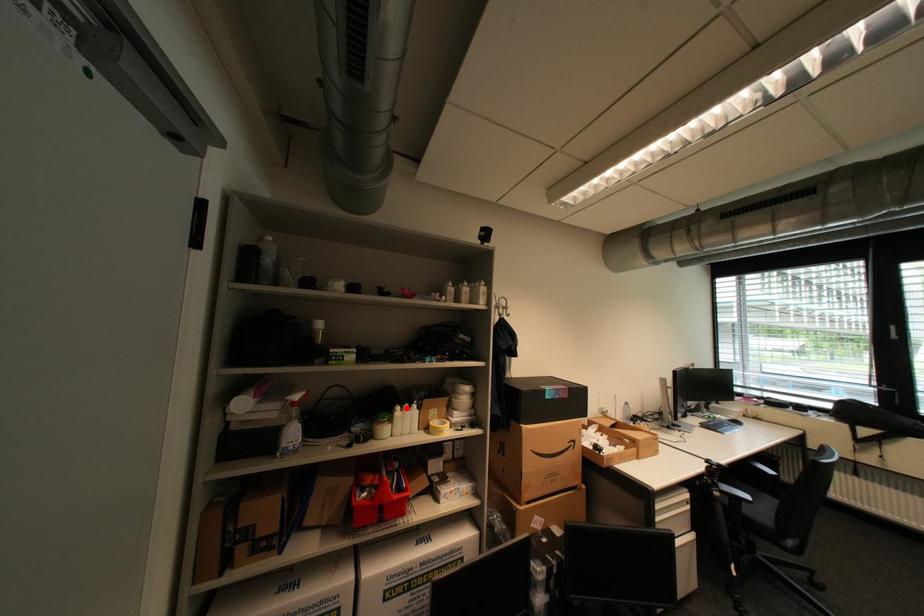
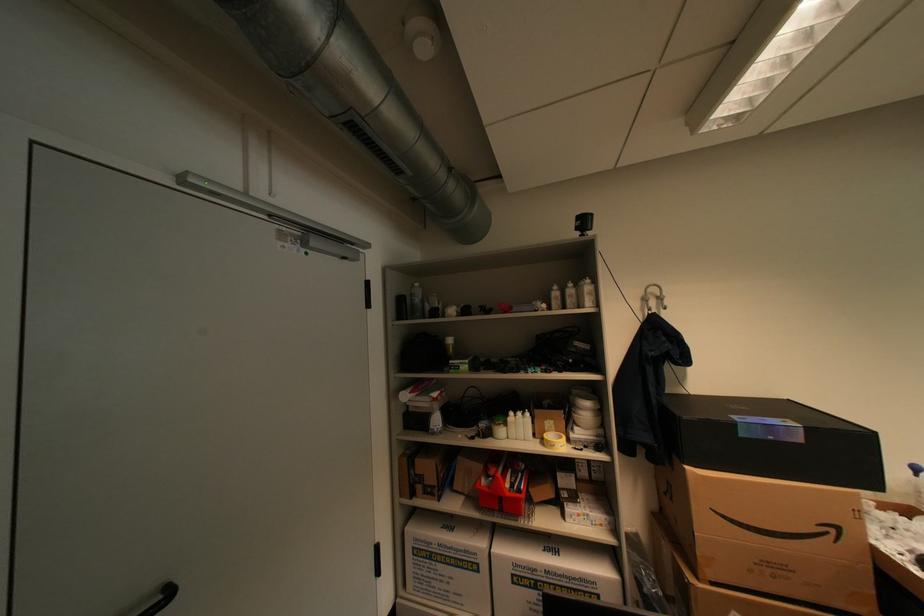
Find the pixel in the second image that matches the highlighted location in the first image.

(519, 414)